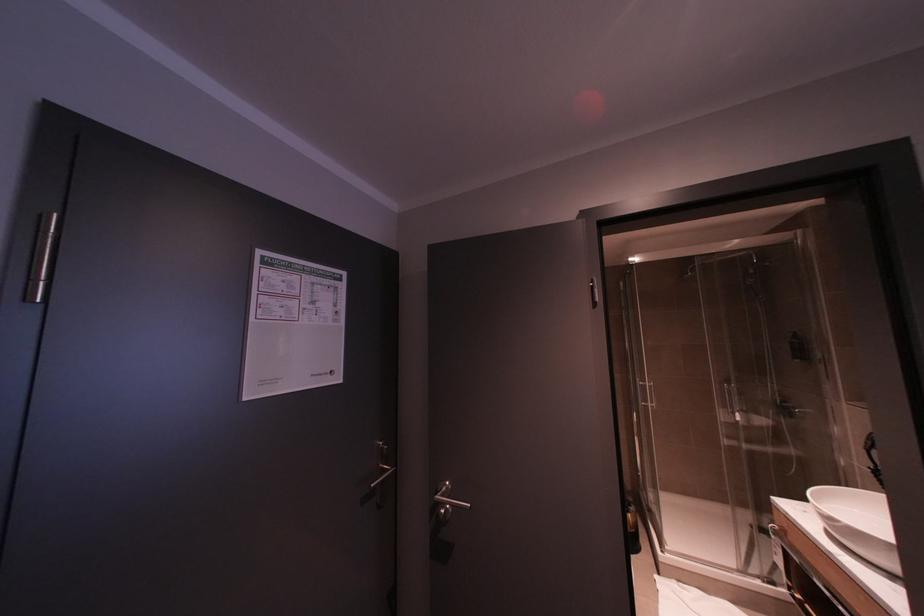
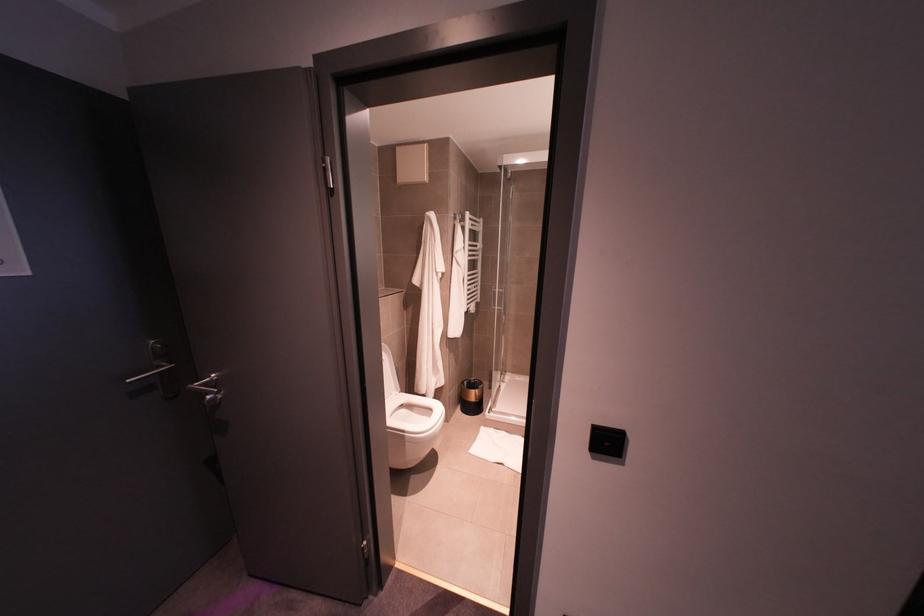
Question: Based on the continuous images, in which direction is the camera rotating? Reply with the corresponding letter.

Choices:
 (A) Left
 (B) Right
 (C) Up
 (D) Down

Answer: (D)